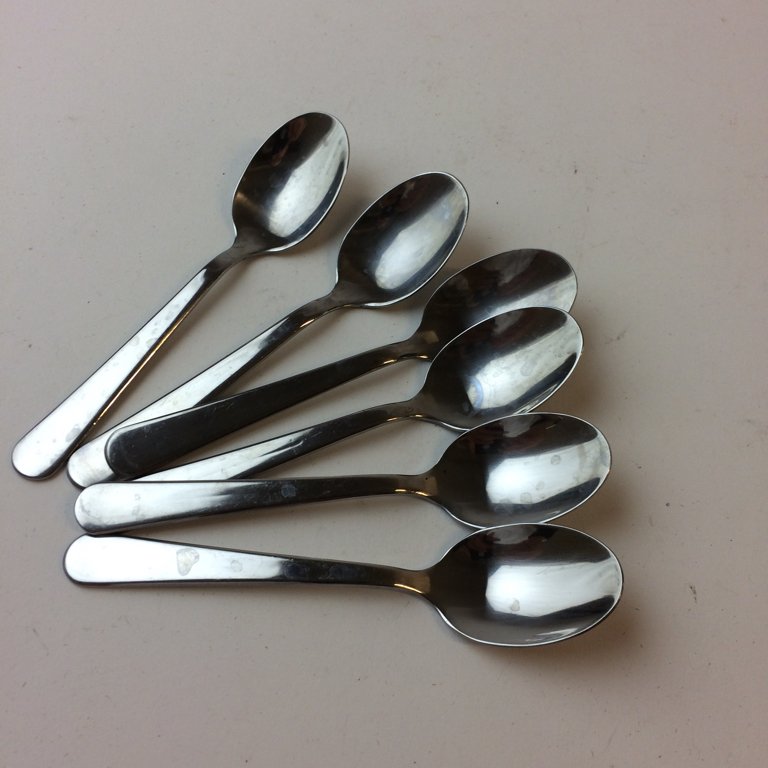
Image resolution: width=768 pixels, height=768 pixels. What are the coordinates of `spoons` in the screenshot? It's located at (548, 578), (548, 475), (515, 376), (507, 296), (414, 257), (286, 220).